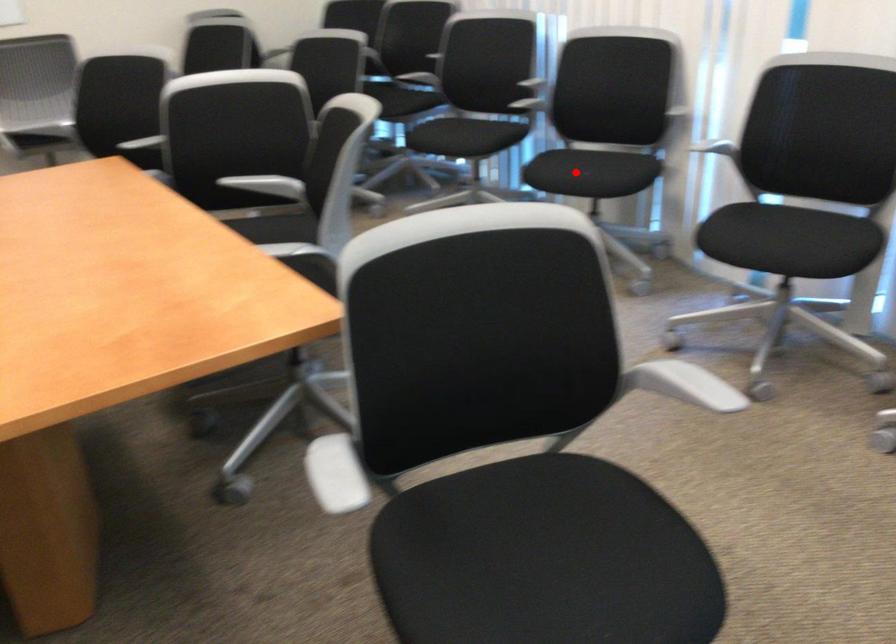
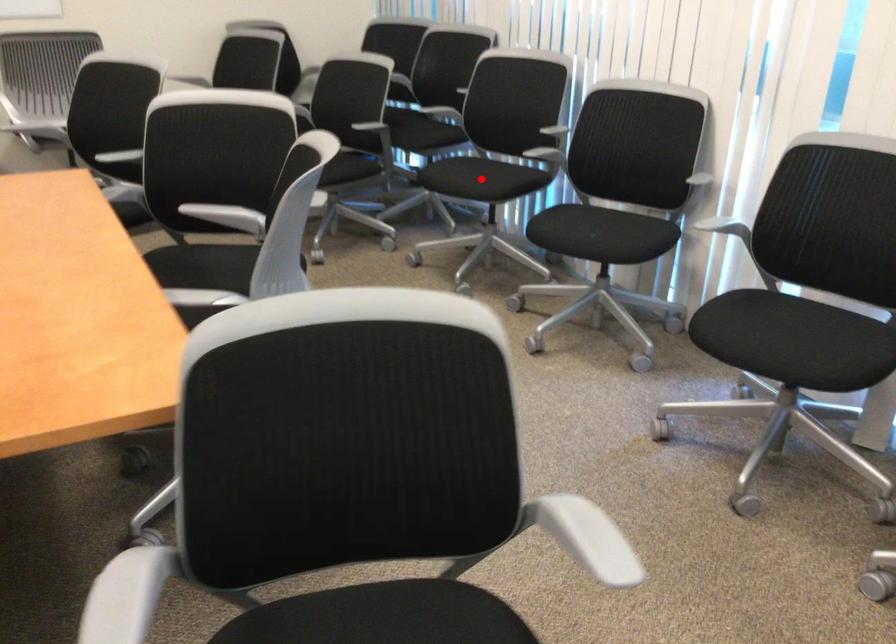
I am providing you with two images of the same scene from different viewpoints. A red point is marked on the first image and another point is marked on the second image. Do the highlighted points in image1 and image2 indicate the same real-world spot?

No